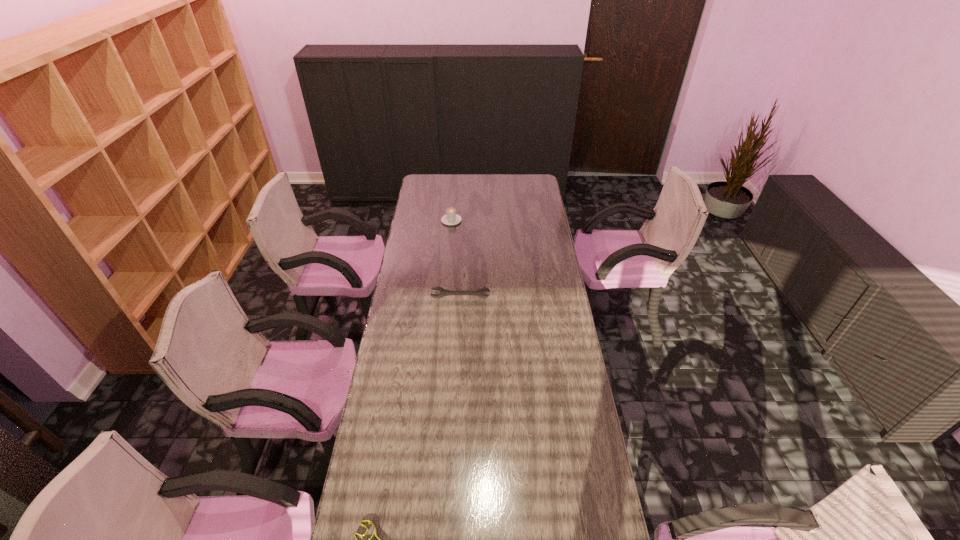
The height and width of the screenshot is (540, 960). I want to click on the closest object relative to the farthest object, so click(443, 292).